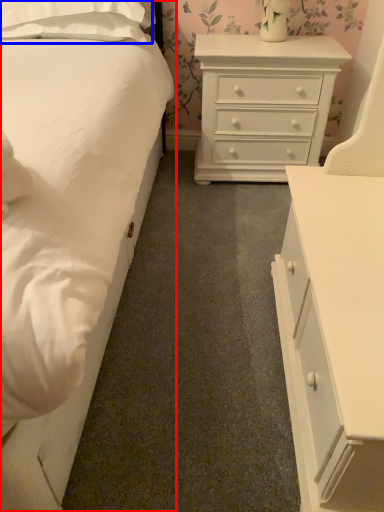
Question: Which point is closer to the camera, bed (highlighted by a red box) or pillow (highlighted by a blue box)?

Choices:
 (A) bed
 (B) pillow

Answer: (A)